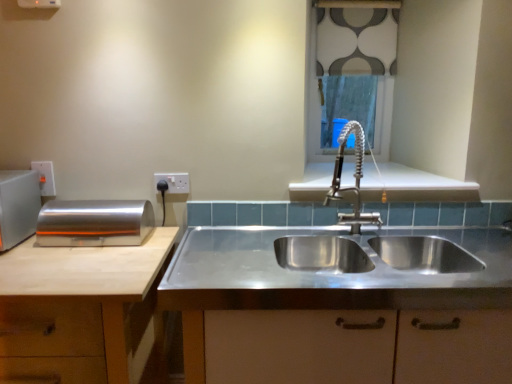
Question: Is stainless steel sink at center outside white plastic electric outlet at upper center, the second electric outlet from the left?

Choices:
 (A) yes
 (B) no

Answer: (A)

Question: Is stainless steel sink at center wider than white plastic electric outlet at upper center, marked as the first electric outlet in a right-to-left arrangement?

Choices:
 (A) yes
 (B) no

Answer: (A)

Question: Is stainless steel sink at center to the right of white plastic electric outlet at upper center, marked as the first electric outlet in a right-to-left arrangement, from the viewer's perspective?

Choices:
 (A) yes
 (B) no

Answer: (A)

Question: Is stainless steel sink at center turned away from white plastic electric outlet at upper center, marked as the first electric outlet in a right-to-left arrangement?

Choices:
 (A) no
 (B) yes

Answer: (A)

Question: Is stainless steel sink at center oriented towards white plastic electric outlet at upper center, the second electric outlet from the left?

Choices:
 (A) no
 (B) yes

Answer: (A)

Question: Is stainless steel sink at center far from white plastic electric outlet at upper center, the second electric outlet from the left?

Choices:
 (A) yes
 (B) no

Answer: (B)

Question: From a real-world perspective, does stainless steel sink at center sit lower than patterned fabric at upper center?

Choices:
 (A) yes
 (B) no

Answer: (A)

Question: Is stainless steel sink at center smaller than patterned fabric at upper center?

Choices:
 (A) no
 (B) yes

Answer: (A)

Question: Is patterned fabric at upper center at the back of stainless steel sink at center?

Choices:
 (A) yes
 (B) no

Answer: (B)

Question: Does stainless steel sink at center come behind patterned fabric at upper center?

Choices:
 (A) yes
 (B) no

Answer: (B)

Question: Is stainless steel sink at center beside patterned fabric at upper center?

Choices:
 (A) no
 (B) yes

Answer: (A)

Question: Is stainless steel sink at center positioned far away from patterned fabric at upper center?

Choices:
 (A) no
 (B) yes

Answer: (B)

Question: Is patterned fabric at upper center wider than stainless steel sink at center?

Choices:
 (A) yes
 (B) no

Answer: (B)